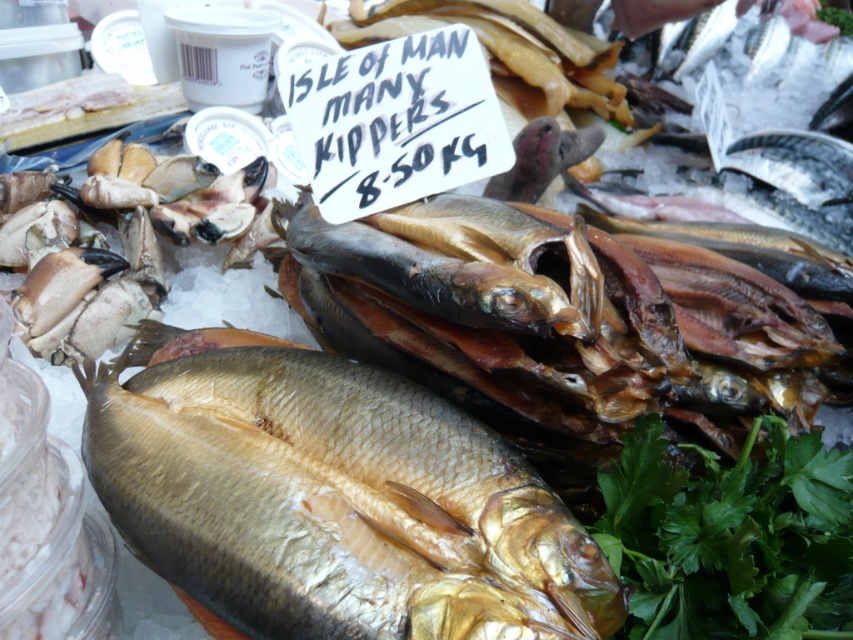
Question: Does shiny golden fish at center appear on the right side of green leafy parsley at lower right?

Choices:
 (A) no
 (B) yes

Answer: (A)

Question: Among these points, which one is farthest from the camera?

Choices:
 (A) (650, 486)
 (B) (86, 372)

Answer: (B)

Question: Which of the following is the farthest from the observer?

Choices:
 (A) (202, 548)
 (B) (717, 502)

Answer: (B)

Question: Is shiny golden fish at center closer to camera compared to green leafy parsley at lower right?

Choices:
 (A) no
 (B) yes

Answer: (B)

Question: Is shiny golden fish at center thinner than green leafy parsley at lower right?

Choices:
 (A) no
 (B) yes

Answer: (A)